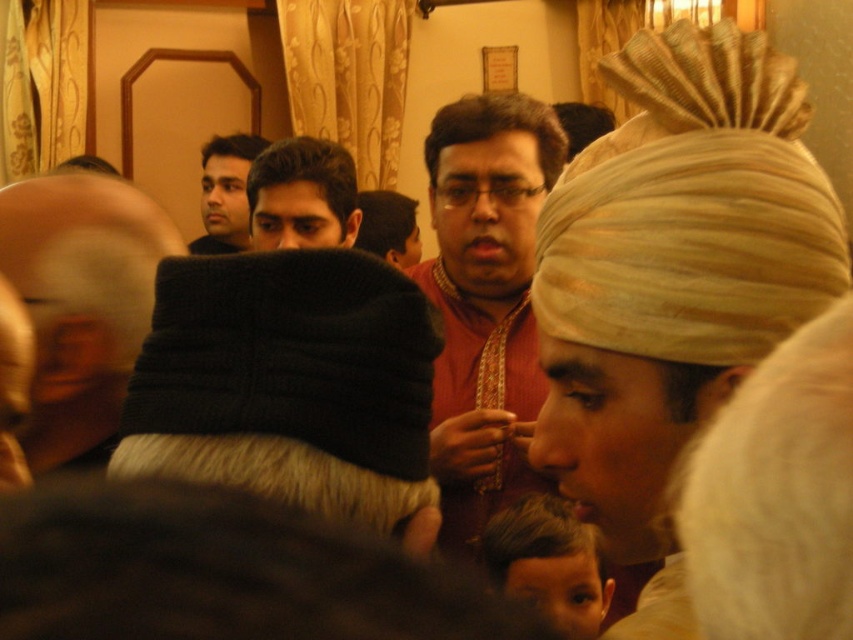
Is point (445, 522) positioned in front of point (61, 220)?

No.

Is matte red kurta at center to the left of black knitted cap at left from the viewer's perspective?

In fact, matte red kurta at center is to the right of black knitted cap at left.

At what (x,y) coordinates should I click in order to perform the action: click on matte red kurta at center. Please return your answer as a coordinate pair (x, y). Image resolution: width=853 pixels, height=640 pixels. Looking at the image, I should click on (485, 298).

Which is in front, point (264, 198) or point (413, 221)?

Positioned in front is point (264, 198).

Which is below, black knitwear at center or smooth black hair at center?

black knitwear at center is lower down.

Which is in front, point (357, 211) or point (404, 228)?

Point (357, 211) is more forward.

The width and height of the screenshot is (853, 640). What are the coordinates of `black knitwear at center` in the screenshot? It's located at (302, 195).

Between black knitted hat at left and smooth black hair at center, which one is positioned lower?

black knitted hat at left is lower down.

You are a GUI agent. You are given a task and a screenshot of the screen. Output one action in this format:
    pyautogui.click(x=<x>, y=<y>)
    Task: Click on the black knitted hat at left
    Image resolution: width=853 pixels, height=640 pixels.
    Given the screenshot: What is the action you would take?
    pyautogui.click(x=289, y=385)